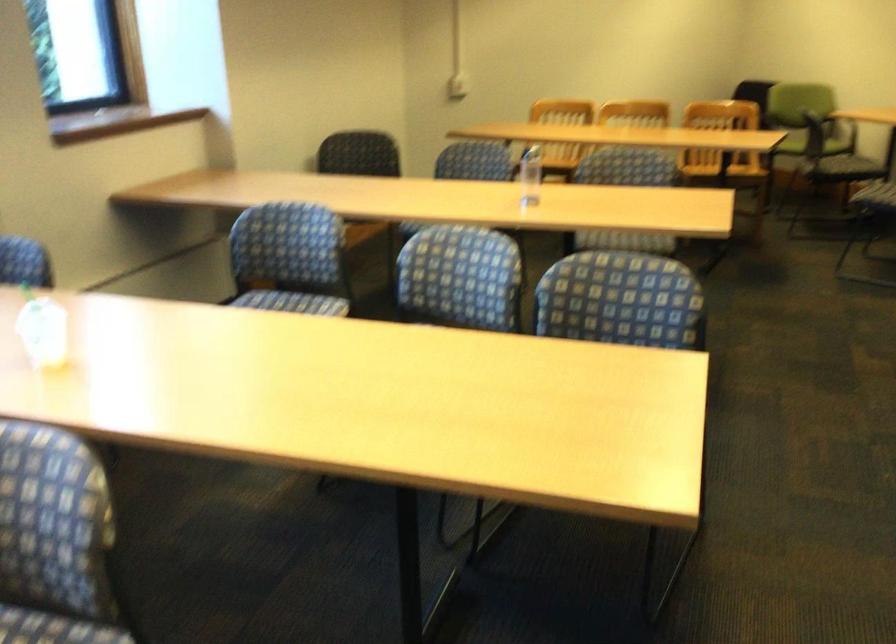
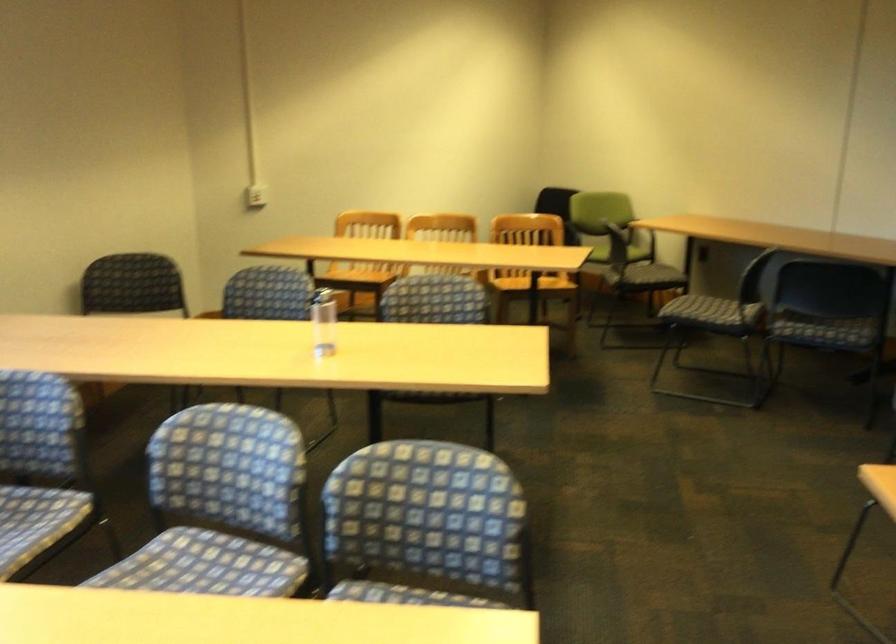
Find the pixel in the second image that matches the point at 452,304 in the first image.

(221, 506)